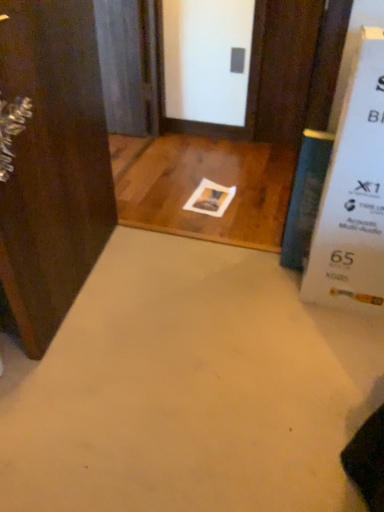
Question: From the image's perspective, is dark wood door at left, which appears as the first door when viewed from the left, under blue glass screen door at upper left?

Choices:
 (A) yes
 (B) no

Answer: (A)

Question: Is dark wood door at left, which appears as the first door when viewed from the left, wider than blue glass screen door at upper left?

Choices:
 (A) yes
 (B) no

Answer: (A)

Question: Could blue glass screen door at upper left be considered to be inside dark wood door at left, acting as the 1th door starting from the front?

Choices:
 (A) yes
 (B) no

Answer: (B)

Question: Is the depth of dark wood door at left, which appears as the first door when viewed from the left, greater than that of blue glass screen door at upper left?

Choices:
 (A) yes
 (B) no

Answer: (B)

Question: Considering the relative sizes of dark wood door at left, acting as the 1th door starting from the front, and blue glass screen door at upper left in the image provided, is dark wood door at left, acting as the 1th door starting from the front, thinner than blue glass screen door at upper left?

Choices:
 (A) no
 (B) yes

Answer: (A)

Question: Do you think dark wood door at left, which appears as the first door when viewed from the left, is within blue glass screen door at upper left, or outside of it?

Choices:
 (A) outside
 (B) inside

Answer: (A)

Question: Is point (14, 242) positioned closer to the camera than point (117, 78)?

Choices:
 (A) farther
 (B) closer

Answer: (B)

Question: Looking at their shapes, would you say dark wood door at left, the 2th door from the back, is wider or thinner than blue glass screen door at upper left?

Choices:
 (A) wide
 (B) thin

Answer: (A)

Question: Considering the relative positions of dark wood door at left, which is the second door in top-to-bottom order, and blue glass screen door at upper left in the image provided, is dark wood door at left, which is the second door in top-to-bottom order, to the left or to the right of blue glass screen door at upper left?

Choices:
 (A) left
 (B) right

Answer: (A)

Question: From the image's perspective, is brown wood door at upper center, acting as the first door starting from the top, positioned above or below dark wood door at left, which is the 1th door in bottom-to-top order?

Choices:
 (A) below
 (B) above

Answer: (B)

Question: Based on their sizes in the image, would you say brown wood door at upper center, which is the 1th door in right-to-left order, is bigger or smaller than dark wood door at left, which appears as the first door when viewed from the left?

Choices:
 (A) small
 (B) big

Answer: (A)

Question: From a real-world perspective, is brown wood door at upper center, which is the 1th door in right-to-left order, physically located above or below dark wood door at left, acting as the 1th door starting from the front?

Choices:
 (A) below
 (B) above

Answer: (A)

Question: Is brown wood door at upper center, the 2th door from the front, inside or outside of dark wood door at left, which appears as the first door when viewed from the left?

Choices:
 (A) inside
 (B) outside

Answer: (B)

Question: Considering the relative positions of brown wood door at upper center, the second door positioned from the left, and blue glass screen door at upper left in the image provided, is brown wood door at upper center, the second door positioned from the left, to the left or to the right of blue glass screen door at upper left?

Choices:
 (A) left
 (B) right

Answer: (B)

Question: Does point (274, 115) appear closer or farther from the camera than point (124, 19)?

Choices:
 (A) closer
 (B) farther

Answer: (B)